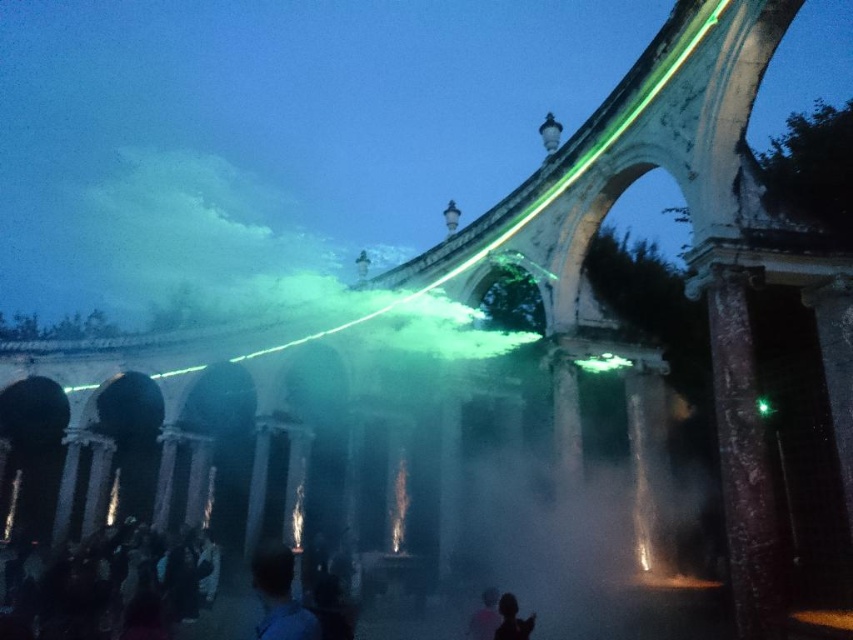
Looking at this image, you are an artist trying to sketch this scene. You notice the blue fabric at center and the silhouette skin at lower center. Which object should you draw first if you want to follow the rule of drawing background elements before foreground elements?

The blue fabric at center should be drawn first because it is taller than the silhouette skin at lower center, indicating it is likely in the background.

You are standing at the entrance of the colonnade structure and see a point marked at coordinates [485,616]. What object is located at that point?

The point at coordinates [485,616] indicates a silvery metallic figure at center.